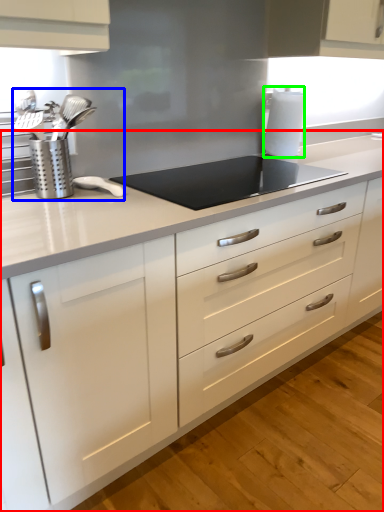
Question: Estimate the real-world distances between objects in this image. Which object is closer to countertop (highlighted by a red box), sink (highlighted by a blue box) or paper towel (highlighted by a green box)?

Choices:
 (A) sink
 (B) paper towel

Answer: (A)